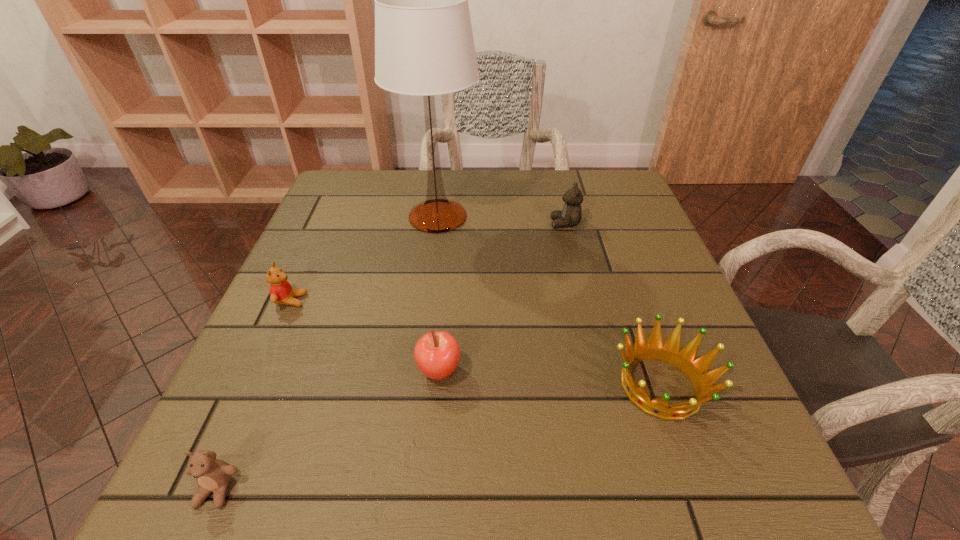
This screenshot has width=960, height=540. In order to click on unoccupied area between the tallest object and the second nearest teddy bear in this screenshot , I will do `click(364, 259)`.

This screenshot has height=540, width=960. Find the location of `free space between the crown and the nearest teddy bear`. free space between the crown and the nearest teddy bear is located at coordinates (439, 438).

The width and height of the screenshot is (960, 540). What are the coordinates of `free spot between the crown and the apple` in the screenshot? It's located at 550,379.

Locate which object ranks in proximity to the tallest teddy bear. Please provide its 2D coordinates. Your answer should be formatted as a tuple, i.e. [(x, y)], where the tuple contains the x and y coordinates of a point satisfying the conditions above.

[(424, 45)]

Point out which object is positioned as the fourth nearest to the rightmost teddy bear. Please provide its 2D coordinates. Your answer should be formatted as a tuple, i.e. [(x, y)], where the tuple contains the x and y coordinates of a point satisfying the conditions above.

[(281, 292)]

Identify which teddy bear is the nearest to the second nearest teddy bear. Please provide its 2D coordinates. Your answer should be formatted as a tuple, i.e. [(x, y)], where the tuple contains the x and y coordinates of a point satisfying the conditions above.

[(213, 475)]

Find the location of `teddy bear that is the nearest to the table lamp`. teddy bear that is the nearest to the table lamp is located at coordinates (571, 214).

What are the coordinates of `free location that satisfies the following two spatial constraints: 1. on the face of the tallest teddy bear; 2. on the front-facing side of the nearest object` in the screenshot? It's located at (630, 490).

Where is `free spot that satisfies the following two spatial constraints: 1. above the cylindrical shade of the tallest object; 2. on the front-facing side of the nearest teddy bear`? This screenshot has width=960, height=540. free spot that satisfies the following two spatial constraints: 1. above the cylindrical shade of the tallest object; 2. on the front-facing side of the nearest teddy bear is located at coordinates (403, 490).

I want to click on free spot that satisfies the following two spatial constraints: 1. above the cylindrical shade of the table lamp; 2. on the back side of the crown, so click(x=417, y=386).